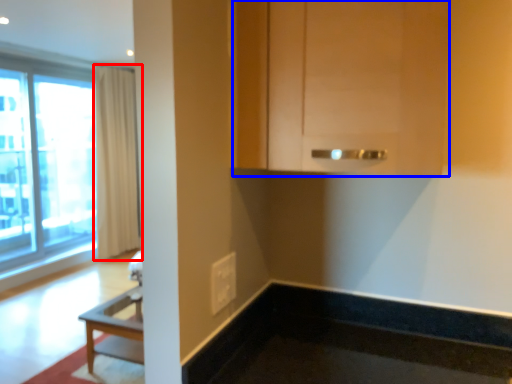
Question: Among these objects, which one is farthest to the camera, curtain (highlighted by a red box) or cabinetry (highlighted by a blue box)?

Choices:
 (A) curtain
 (B) cabinetry

Answer: (A)